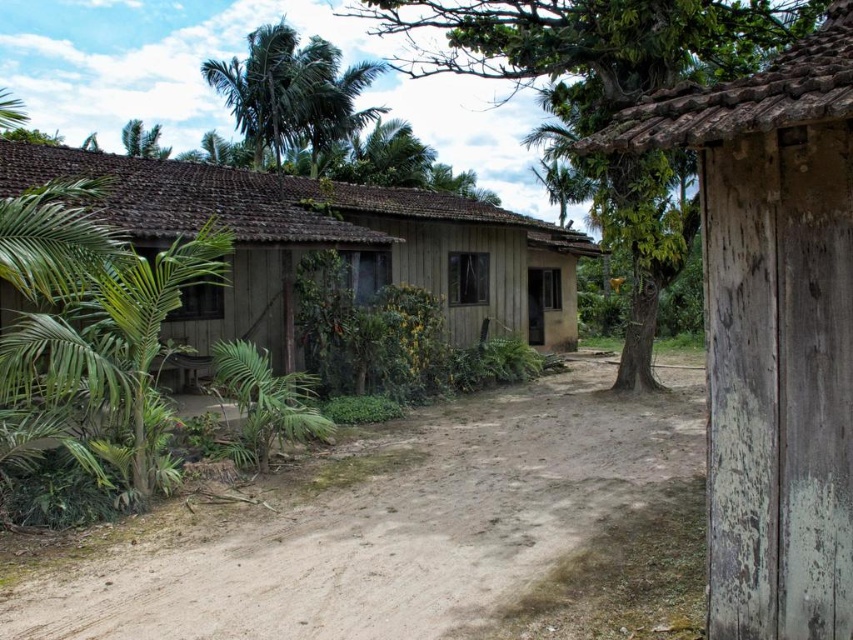
Which of these two, brown sandy dirt track at lower center or green leafy tree at center, stands shorter?

brown sandy dirt track at lower center is shorter.

Is point (398, 528) positioned in front of point (753, 33)?

Yes, point (398, 528) is closer to viewer.

This screenshot has height=640, width=853. What are the coordinates of `brown sandy dirt track at lower center` in the screenshot? It's located at (412, 531).

Can you confirm if weathered wood hut at right is positioned to the left of brown wooden hut at center?

In fact, weathered wood hut at right is to the right of brown wooden hut at center.

Does weathered wood hut at right have a smaller size compared to brown wooden hut at center?

Correct, weathered wood hut at right occupies less space than brown wooden hut at center.

What do you see at coordinates (772, 328) in the screenshot? I see `weathered wood hut at right` at bounding box center [772, 328].

Identify the location of weathered wood hut at right. (772, 328).

Who is positioned more to the right, brown sandy dirt track at lower center or brown wooden hut at center?

brown sandy dirt track at lower center

This screenshot has width=853, height=640. What do you see at coordinates (412, 531) in the screenshot?
I see `brown sandy dirt track at lower center` at bounding box center [412, 531].

Who is more distant from viewer, (316, 602) or (476, 336)?

The point (476, 336) is more distant.

The width and height of the screenshot is (853, 640). Find the location of `brown sandy dirt track at lower center`. brown sandy dirt track at lower center is located at coordinates (412, 531).